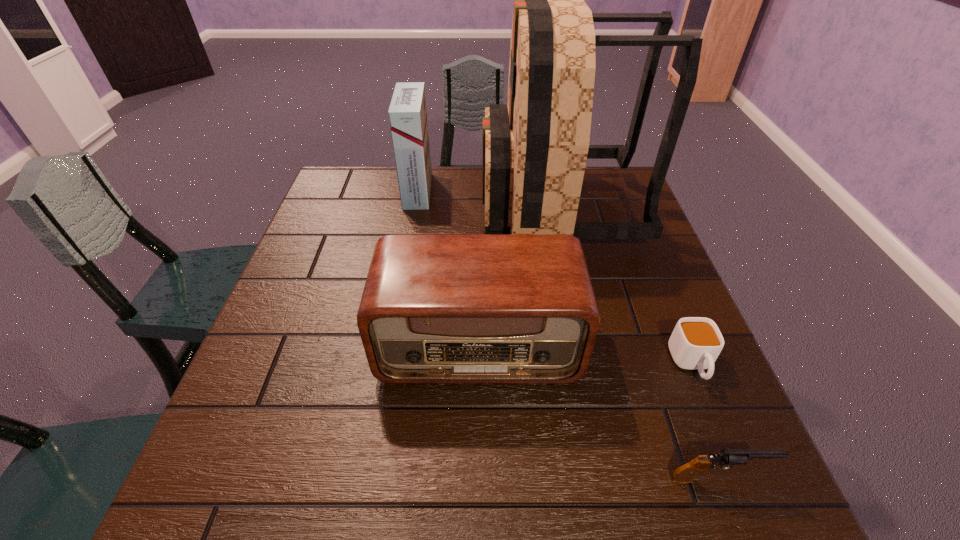
Locate an element on the screen. The width and height of the screenshot is (960, 540). backpack is located at coordinates (535, 147).

I want to click on the fourth shortest object, so click(x=407, y=113).

Locate an element on the screen. the third shortest object is located at coordinates (436, 308).

I want to click on gun, so click(x=686, y=473).

The image size is (960, 540). Find the location of `the nearest object`. the nearest object is located at coordinates (686, 473).

The width and height of the screenshot is (960, 540). Identify the location of the shortest object. (695, 343).

This screenshot has width=960, height=540. What are the coordinates of `blank area located 0.200m on the front face of the backpack` in the screenshot? It's located at (413, 210).

At what (x,y) coordinates should I click in order to perform the action: click on vacant region located 0.060m on the front face of the backpack. Please return your answer as a coordinate pair (x, y). The image size is (960, 540). Looking at the image, I should click on (462, 210).

Locate an element on the screen. This screenshot has width=960, height=540. free space located on the front face of the backpack is located at coordinates (360, 210).

Find the location of a particular element. free region located 0.060m on the front of the cigarette case is located at coordinates (412, 222).